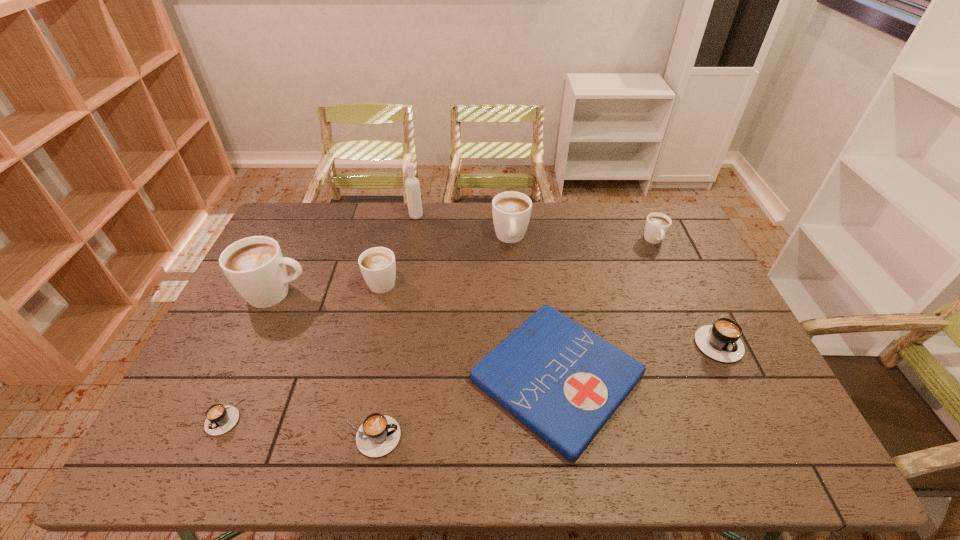
This screenshot has width=960, height=540. Identify the location of object at the far right corner. (657, 225).

At what (x,y) coordinates should I click in order to perform the action: click on free point at the far edge. Please return your answer as a coordinate pair (x, y). Looking at the image, I should click on (334, 226).

This screenshot has height=540, width=960. I want to click on vacant space at the near edge of the desktop, so click(236, 436).

Find the location of a particular element. This screenshot has width=960, height=540. free location at the right edge is located at coordinates (651, 248).

The height and width of the screenshot is (540, 960). Find the location of `free space between the smallest black cappuccino and the tallest cappuccino`. free space between the smallest black cappuccino and the tallest cappuccino is located at coordinates (251, 354).

Identify the location of empty location between the smallest black cappuccino and the white vodka. This screenshot has height=540, width=960. (321, 316).

At what (x,y) coordinates should I click in order to perform the action: click on vacant space in between the rightmost white cappuccino and the second white cappuccino from right to left. Please return your answer as a coordinate pair (x, y). Looking at the image, I should click on (583, 239).

This screenshot has width=960, height=540. I want to click on vacant area between the blue first-aid kit and the third tallest object, so click(534, 307).

The width and height of the screenshot is (960, 540). In order to click on free spot between the third smallest white cappuccino and the leftmost black cappuccino in this screenshot , I will do `click(368, 327)`.

At what (x,y) coordinates should I click in order to perform the action: click on unoccupied position between the rightmost black cappuccino and the third tallest object. Please return your answer as a coordinate pair (x, y). Looking at the image, I should click on (612, 288).